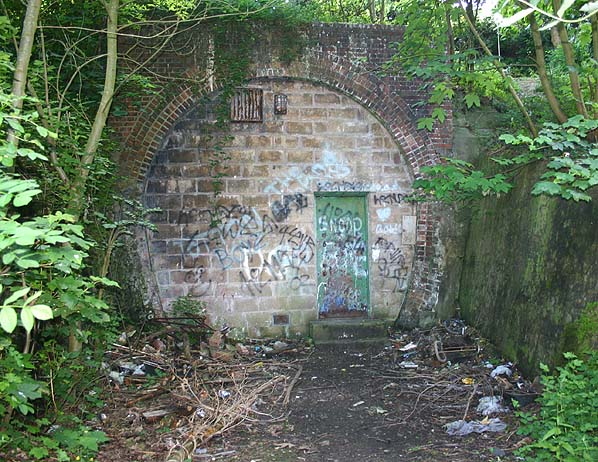
You are a GUI agent. You are given a task and a screenshot of the screen. Output one action in this format:
    pyautogui.click(x=<x>, y=<y>)
    Task: Click on the large vent
    This screenshot has width=598, height=462.
    Given the screenshot: What is the action you would take?
    pyautogui.click(x=245, y=105)